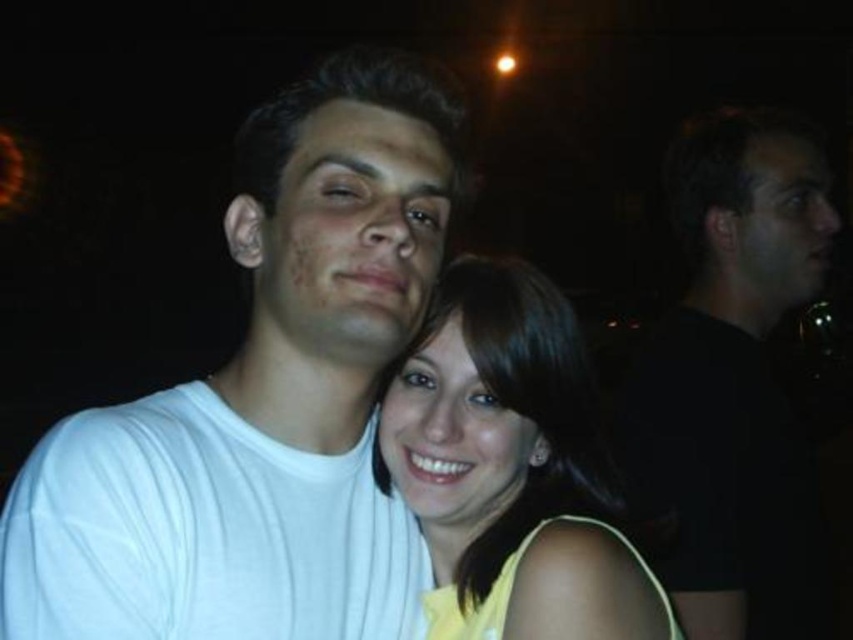
Does white matte t-shirt at center have a greater width compared to yellow matte dress at center?

Correct, the width of white matte t-shirt at center exceeds that of yellow matte dress at center.

Which is in front, point (305, 154) or point (517, 490)?

Positioned in front is point (305, 154).

Which is behind, point (358, 524) or point (409, 502)?

Point (358, 524)

Image resolution: width=853 pixels, height=640 pixels. Find the location of `white matte t-shirt at center`. white matte t-shirt at center is located at coordinates (262, 401).

Can you confirm if black matte shirt at right is smaller than yellow matte dress at center?

Incorrect, black matte shirt at right is not smaller in size than yellow matte dress at center.

Is black matte shirt at right thinner than yellow matte dress at center?

No.

Between point (682, 426) and point (541, 525), which one is positioned in front?

Positioned in front is point (541, 525).

Where is `black matte shirt at right`? black matte shirt at right is located at coordinates (732, 381).

Does white matte t-shirt at center appear under black matte shirt at right?

Correct, white matte t-shirt at center is located below black matte shirt at right.

Is white matte t-shirt at center wider than black matte shirt at right?

No.

Is point (337, 547) positioned before point (677, 248)?

Yes, point (337, 547) is closer to viewer.

You are a GUI agent. You are given a task and a screenshot of the screen. Output one action in this format:
    pyautogui.click(x=<x>, y=<y>)
    Task: Click on the white matte t-shirt at center
    The image size is (853, 640).
    Given the screenshot: What is the action you would take?
    pyautogui.click(x=262, y=401)